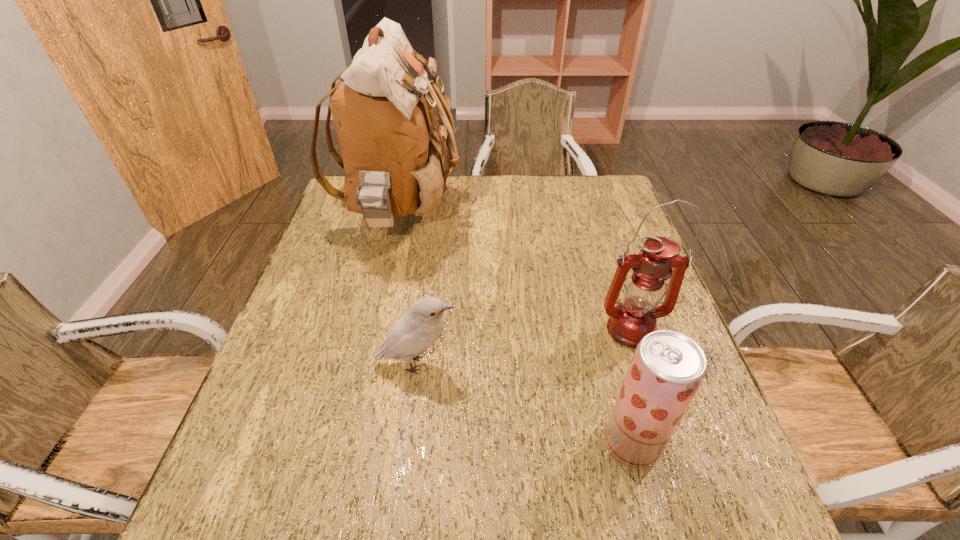
Identify which object is the third closest to the second nearest object. Please provide its 2D coordinates. Your answer should be formatted as a tuple, i.e. [(x, y)], where the tuple contains the x and y coordinates of a point satisfying the conditions above.

[(635, 317)]

This screenshot has height=540, width=960. Identify the location of vacant area in the image that satisfies the following two spatial constraints: 1. on the front-facing side of the tallest object; 2. on the right side of the nearest object. (348, 443).

Locate an element on the screen. vacant point that satisfies the following two spatial constraints: 1. at the beak of the fruit juice; 2. on the left side of the third farthest object is located at coordinates (406, 443).

I want to click on blank space that satisfies the following two spatial constraints: 1. on the front-facing side of the farthest object; 2. on the right side of the third shortest object, so click(374, 330).

Identify the location of free space in the image that satisfies the following two spatial constraints: 1. on the front-facing side of the fruit juice; 2. on the right side of the backpack. The height and width of the screenshot is (540, 960). (348, 443).

Where is `vacant region that satisfies the following two spatial constraints: 1. on the front side of the oil lamp; 2. at the beak of the shortest object`? Image resolution: width=960 pixels, height=540 pixels. vacant region that satisfies the following two spatial constraints: 1. on the front side of the oil lamp; 2. at the beak of the shortest object is located at coordinates (640, 364).

Where is `vacant region that satisfies the following two spatial constraints: 1. at the beak of the nearest object; 2. on the right side of the bird`? Image resolution: width=960 pixels, height=540 pixels. vacant region that satisfies the following two spatial constraints: 1. at the beak of the nearest object; 2. on the right side of the bird is located at coordinates (406, 443).

You are a GUI agent. You are given a task and a screenshot of the screen. Output one action in this format:
    pyautogui.click(x=<x>, y=<y>)
    Task: Click on the vacant point that satisfies the following two spatial constraints: 1. at the beak of the nearest object; 2. on the left side of the third farthest object
    
    Given the screenshot: What is the action you would take?
    pyautogui.click(x=406, y=443)

The image size is (960, 540). What are the coordinates of `vacant space that satisfies the following two spatial constraints: 1. on the front-facing side of the farthest object; 2. on the back side of the third nearest object` in the screenshot? It's located at (374, 330).

Locate an element on the screen. free space that satisfies the following two spatial constraints: 1. on the back side of the third shortest object; 2. on the front-facing side of the farthest object is located at coordinates (592, 216).